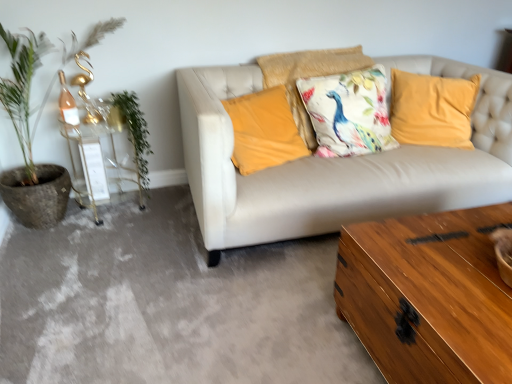
Image resolution: width=512 pixels, height=384 pixels. I want to click on free space on the front side of green leafy plant at left, so (x=85, y=270).